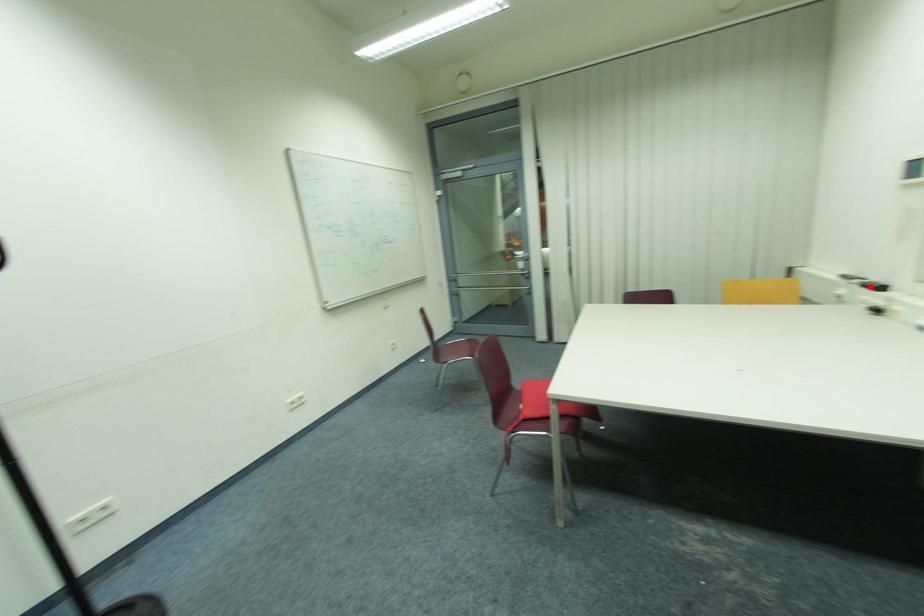
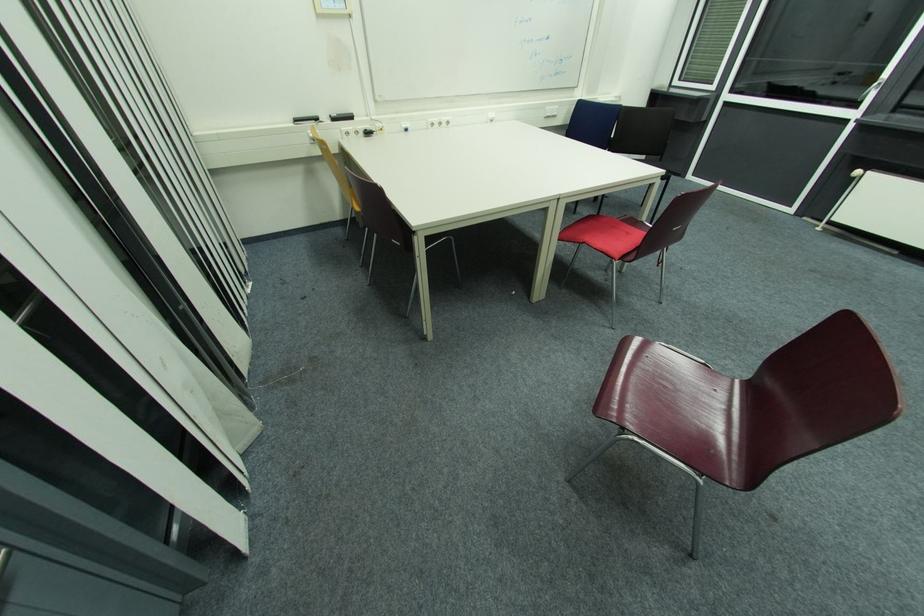
Question: A red point is marked in image1. In image2, is the corresponding 3D point closer to the camera or farther? Reply with the corresponding letter.

Choices:
 (A) The corresponding 3D point is closer.
 (B) The corresponding 3D point is farther.

Answer: (A)